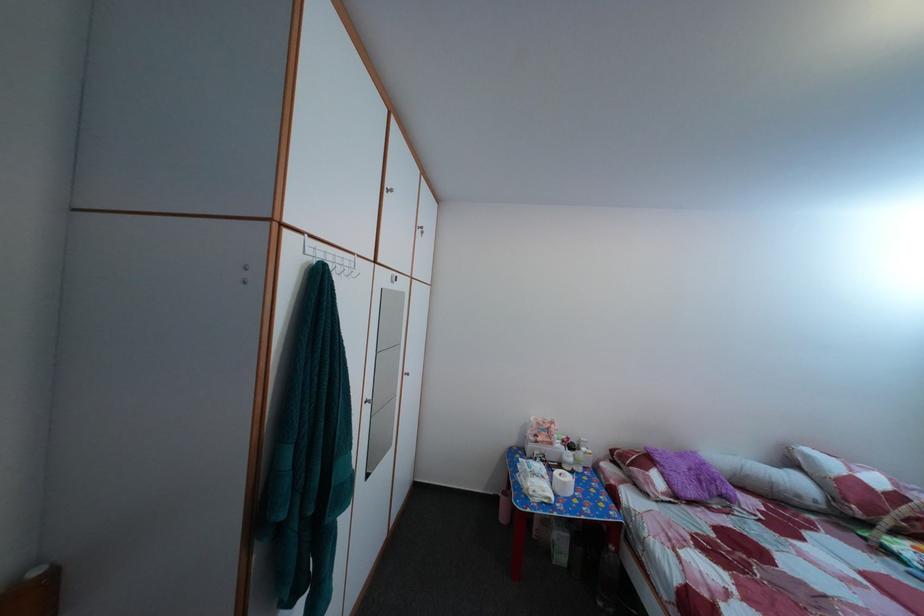
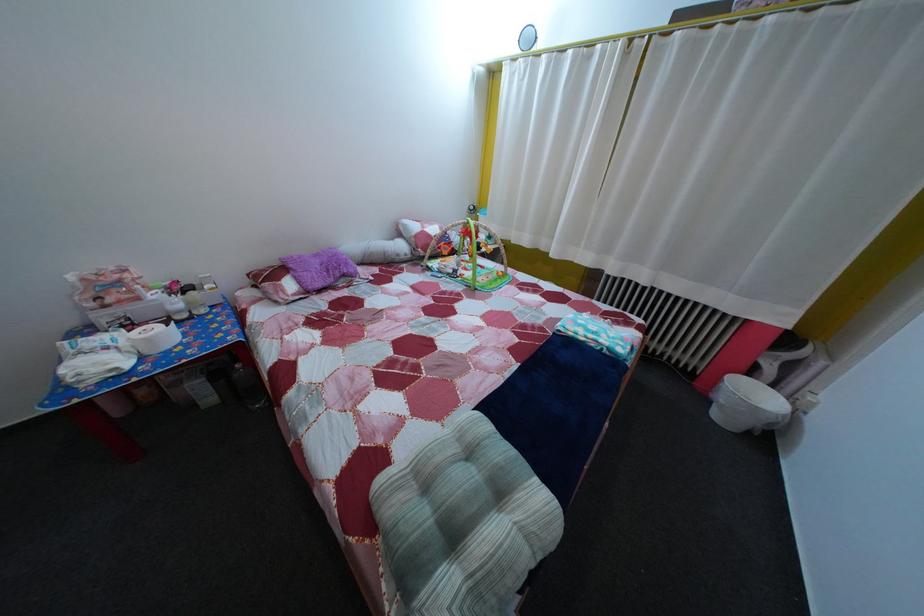
Where in the second image is the point corresponding to point 574,492 from the first image?

(157, 347)